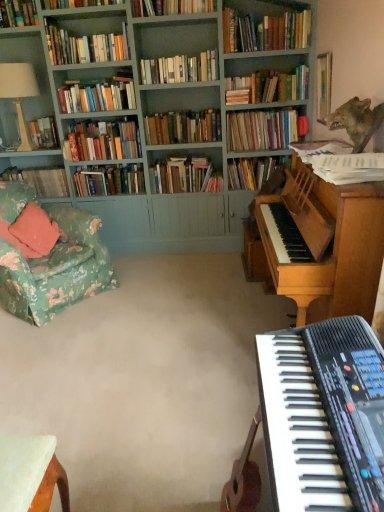
Question: From a real-world perspective, is teal painted wood bookcase at upper left above or below hardcover books at center, which appears as the 8th book when viewed from the back?

Choices:
 (A) above
 (B) below

Answer: (A)

Question: Is point (299, 3) positioned closer to the camera than point (284, 139)?

Choices:
 (A) closer
 (B) farther

Answer: (A)

Question: Which object is the closest to the teal painted wood bookcase at upper left?

Choices:
 (A) hardcover books at upper left, marked as the 11th book in a back-to-front arrangement
 (B) hardcover books at center, the 2th book positioned from the back
 (C) hardcover book at center, marked as the eleventh book in a front-to-back arrangement
 (D) floral fabric chair at left
 (E) hardcover books at center, positioned as the 5th book in back-to-front order

Answer: (E)

Question: Which of these objects is positioned farthest from the hardcover books at upper center, which is the second book in front-to-back order?

Choices:
 (A) hardcover book at center, the 4th book in the back-to-front sequence
 (B) hardcover books at center, the tenth book viewed from the front
 (C) hardcover books at upper center, which ranks as the tenth book in back-to-front order
 (D) white paper at upper right, acting as the 1th book starting from the front
 (E) hardcover books at center, which appears as the 8th book when viewed from the back

Answer: (D)